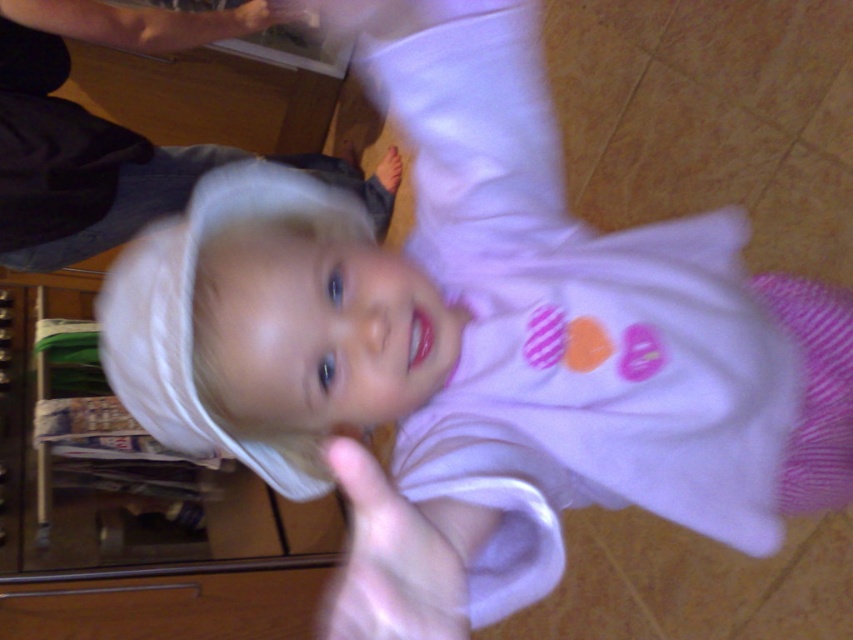
Based on the scene description, can you identify the object located at the coordinates point (85, 132)?

The point (85, 132) corresponds to the white fabric at upper center.

You are a delivery person who needs to place a package on the white fabric at upper center. The package is 1.5 meters long. Can you safely place it there without it overlapping the pink fabric hand at center?

The white fabric at upper center is 1.31 meters from the pink fabric hand at center. Since the package is 1.5 meters long, placing it would cause it to extend beyond the available space, overlapping the pink fabric hand at center. Therefore, it cannot be safely placed there.

You are a photographer trying to capture a candid shot of the child in the scene. You notice the white fabric at upper center and the smooth skin hand at upper center in your viewfinder. To ensure the hand is not blocking the fabric in the final photo, what should you advise the person holding the hand to do?

The white fabric at upper center and smooth skin hand at upper center are 15.51 inches apart from each other. To prevent the hand from blocking the fabric, the person should move their hand away from the fabric by at least 15.51 inches.